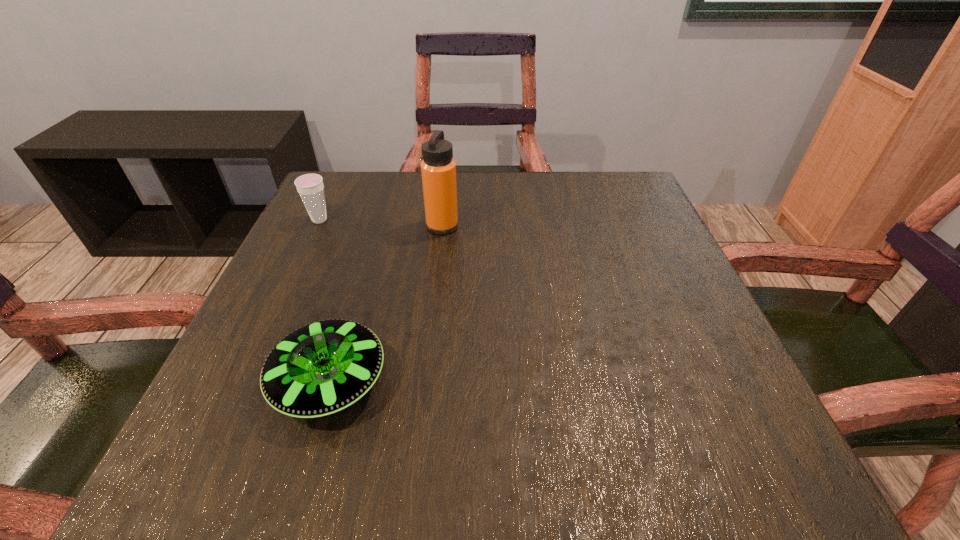
Image resolution: width=960 pixels, height=540 pixels. In order to click on object situated at the near edge in this screenshot , I will do `click(324, 367)`.

You are a GUI agent. You are given a task and a screenshot of the screen. Output one action in this format:
    pyautogui.click(x=<x>, y=<y>)
    Task: Click on the cup at the left edge
    The width and height of the screenshot is (960, 540).
    Given the screenshot: What is the action you would take?
    pyautogui.click(x=310, y=187)

Identify the location of saucer present at the left edge. (324, 367).

I want to click on object that is positioned at the far left corner, so click(x=310, y=187).

This screenshot has width=960, height=540. Identify the location of object that is at the near left corner. (324, 367).

Where is `free spot at the far edge of the desktop`? free spot at the far edge of the desktop is located at coordinates (480, 209).

Locate an element on the screen. Image resolution: width=960 pixels, height=540 pixels. vacant space at the near edge of the desktop is located at coordinates (475, 477).

The height and width of the screenshot is (540, 960). In the image, there is a desktop. What are the coordinates of `free space at the left edge` in the screenshot? It's located at (372, 229).

Identify the location of vacant space at the right edge. (700, 309).

The image size is (960, 540). I want to click on free region at the far left corner, so click(x=352, y=172).